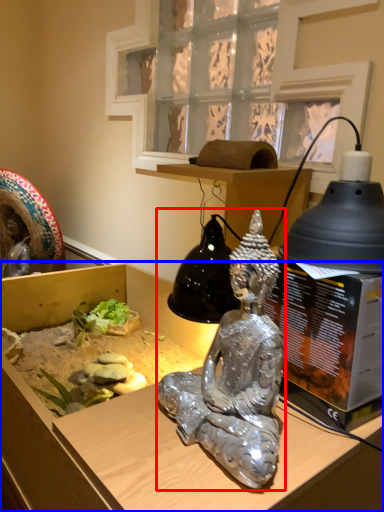
Question: Which of the following is the closest to the observer, person (highlighted by a red box) or furniture (highlighted by a blue box)?

Choices:
 (A) person
 (B) furniture

Answer: (B)